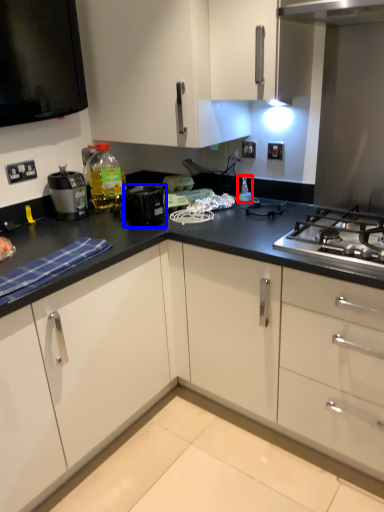
Question: Which object is closer to the camera taking this photo, appliance (highlighted by a red box) or kitchen appliance (highlighted by a blue box)?

Choices:
 (A) appliance
 (B) kitchen appliance

Answer: (B)